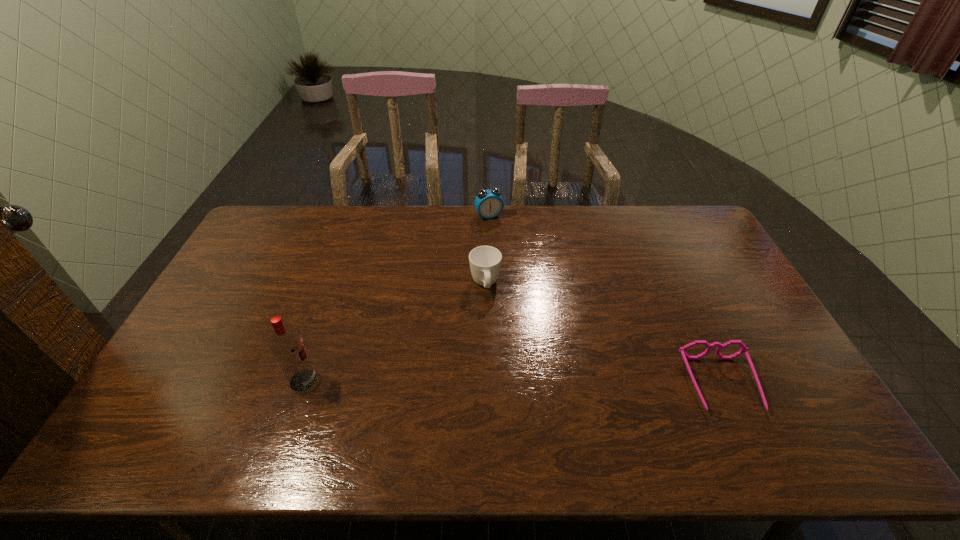
At what (x,y) coordinates should I click in order to perform the action: click on the tallest object. Please return your answer as a coordinate pair (x, y). This screenshot has width=960, height=540. Looking at the image, I should click on (286, 343).

Identify the location of vodka. (286, 343).

Locate an element on the screen. Image resolution: width=960 pixels, height=540 pixels. the shortest object is located at coordinates (744, 349).

Locate an element on the screen. The height and width of the screenshot is (540, 960). spectacles is located at coordinates (744, 349).

I want to click on cup, so click(485, 261).

The image size is (960, 540). Identify the location of alarm clock. (488, 203).

Identify the location of free space located on the front label of the tallest object. The width and height of the screenshot is (960, 540). (344, 381).

You are a GUI agent. You are given a task and a screenshot of the screen. Output one action in this format:
    pyautogui.click(x=<x>, y=<y>)
    Task: Click on the free region located with the handle on the side of the cup
    This screenshot has height=540, width=960.
    Given the screenshot: What is the action you would take?
    pyautogui.click(x=501, y=396)

Locate an element on the screen. This screenshot has width=960, height=540. blank space located with the handle on the side of the cup is located at coordinates (503, 407).

Locate an element on the screen. The height and width of the screenshot is (540, 960). blank space located with the handle on the side of the cup is located at coordinates (490, 320).